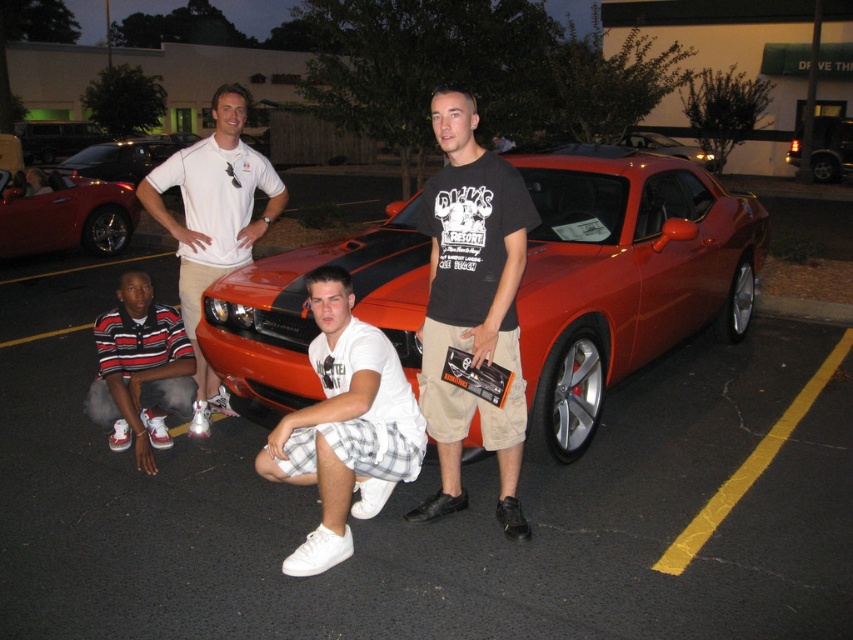
Question: Estimate the real-world distances between objects in this image. Which object is closer to the metallic orange car at center?

Choices:
 (A) black cotton t-shirt at center
 (B) shiny red convertible at left
 (C) striped cotton shirt at lower left
 (D) shiny metallic car at center

Answer: (D)

Question: Can you confirm if shiny metallic car at center is thinner than white cotton polo shirt at upper center?

Choices:
 (A) yes
 (B) no

Answer: (A)

Question: Which of the following is the farthest from the observer?

Choices:
 (A) (489, 280)
 (B) (828, 129)
 (C) (200, 362)

Answer: (B)

Question: Observing the image, what is the correct spatial positioning of shiny metallic car at center in reference to white plaid shorts at center?

Choices:
 (A) below
 (B) above

Answer: (B)

Question: Can you confirm if striped cotton shirt at lower left is bigger than shiny black car at upper left?

Choices:
 (A) no
 (B) yes

Answer: (A)

Question: Which of the following is the farthest from the observer?

Choices:
 (A) shiny metallic car at center
 (B) white plaid shorts at center
 (C) shiny red convertible at left
 (D) shiny orange car at center

Answer: (D)